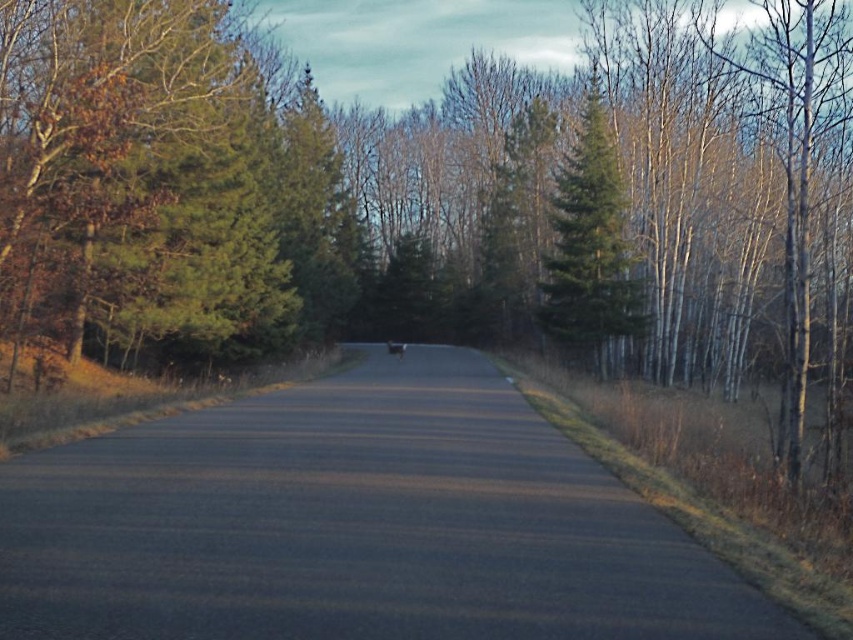
You are driving a car and want to turn left onto a side road that branches off from the current road. You see the asphalt road at center and the green matte tree at center. Which one should you focus on to make the turn safely?

You should focus on the asphalt road at center because it is in front of the green matte tree at center, meaning the road is closer to you and the correct path to follow for the turn.

Looking at this image, you are a pedestrian standing on the asphalt road at center. You want to take shelter from the rain under the green matte tree at center. Can you walk directly to the base of the tree without leaving the road?

The asphalt road at center is positioned under green matte tree at center, so yes, you can walk directly to the base of the tree without leaving the road since the road is already under the tree.

From the picture: You are standing on the side of the road in this rural scene. You notice an asphalt road at center and a green matte tree at center. From your perspective, which object is positioned to the left?

The asphalt road at center is to the left of the green matte tree at center.